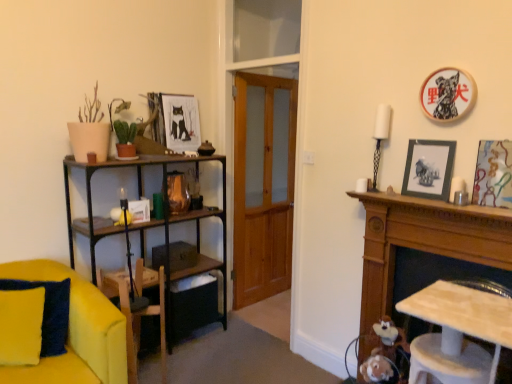
Question: Is matte paper picture frame at upper center, which is the fourth picture frame in right-to-left order, oriented away from wooden armchair at lower left?

Choices:
 (A) no
 (B) yes

Answer: (A)

Question: Is matte paper picture frame at upper center, which is the fourth picture frame in right-to-left order, shorter than wooden armchair at lower left?

Choices:
 (A) no
 (B) yes

Answer: (B)

Question: Is matte paper picture frame at upper center, which appears as the fourth picture frame when viewed from the front, next to wooden armchair at lower left and touching it?

Choices:
 (A) no
 (B) yes

Answer: (A)

Question: Considering the relative positions of matte paper picture frame at upper center, which is the fourth picture frame in right-to-left order, and wooden armchair at lower left in the image provided, is matte paper picture frame at upper center, which is the fourth picture frame in right-to-left order, behind wooden armchair at lower left?

Choices:
 (A) no
 (B) yes

Answer: (B)

Question: Does matte paper picture frame at upper center, which appears as the first picture frame when viewed from the back, appear on the left side of wooden armchair at lower left?

Choices:
 (A) no
 (B) yes

Answer: (A)

Question: Looking at the image, does yellow fabric cushion at lower left seem bigger or smaller compared to wooden mantelpiece at right?

Choices:
 (A) big
 (B) small

Answer: (B)

Question: In the image, is yellow fabric cushion at lower left on the left side or the right side of wooden mantelpiece at right?

Choices:
 (A) left
 (B) right

Answer: (A)

Question: Is yellow fabric cushion at lower left inside or outside of wooden mantelpiece at right?

Choices:
 (A) inside
 (B) outside

Answer: (B)

Question: From the image's perspective, is yellow fabric cushion at lower left positioned above or below wooden mantelpiece at right?

Choices:
 (A) below
 (B) above

Answer: (B)

Question: Looking at their shapes, would you say matte black picture frame at upper right, which is the third picture frame in front-to-back order, is wider or thinner than metallic silver picture frame at right, placed as the first picture frame when sorted from right to left?

Choices:
 (A) thin
 (B) wide

Answer: (B)

Question: Is matte black picture frame at upper right, the second picture frame when ordered from back to front, in front of or behind metallic silver picture frame at right, acting as the 4th picture frame starting from the back, in the image?

Choices:
 (A) front
 (B) behind

Answer: (B)

Question: In terms of height, does matte black picture frame at upper right, the second picture frame when ordered from back to front, look taller or shorter compared to metallic silver picture frame at right, placed as the first picture frame when sorted from right to left?

Choices:
 (A) short
 (B) tall

Answer: (A)

Question: Is point (419, 185) closer or farther from the camera than point (480, 144)?

Choices:
 (A) closer
 (B) farther

Answer: (B)

Question: In terms of width, does metallic silver picture frame at right, placed as the first picture frame when sorted from right to left, look wider or thinner when compared to wooden armchair at lower left?

Choices:
 (A) wide
 (B) thin

Answer: (B)

Question: From the image's perspective, is metallic silver picture frame at right, acting as the 4th picture frame starting from the back, positioned above or below wooden armchair at lower left?

Choices:
 (A) above
 (B) below

Answer: (A)